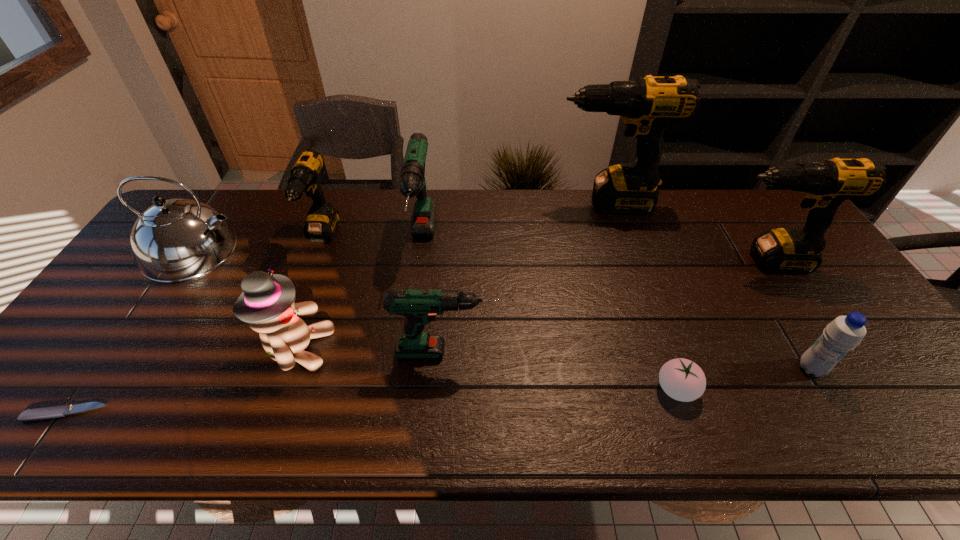
Identify the location of free spot located at the tip of the second biggest black drill. The width and height of the screenshot is (960, 540). (654, 261).

I want to click on vacant position located 0.250m on the handle side of the farther green drill, so click(406, 360).

At what (x,y) coordinates should I click in order to perform the action: click on free space located 0.120m from the spout of the kettle. Please return your answer as a coordinate pair (x, y). Image resolution: width=960 pixels, height=540 pixels. Looking at the image, I should click on (283, 251).

This screenshot has height=540, width=960. In order to click on vacant space located at the tip of the leftmost drill in this screenshot , I will do `click(284, 337)`.

The image size is (960, 540). What are the coordinates of `free space located on the front-facing side of the rag_doll` in the screenshot? It's located at (360, 349).

This screenshot has height=540, width=960. Identify the location of free region located on the handle side of the nearest drill. (587, 352).

Locate an element on the screen. This screenshot has height=540, width=960. vacant point located on the right of the water bottle is located at coordinates (872, 368).

Image resolution: width=960 pixels, height=540 pixels. I want to click on vacant space located 0.270m on the right of the tomato, so click(817, 389).

I want to click on vacant region located on the back of the steak knife, so click(87, 383).

Locate an element on the screen. This screenshot has height=540, width=960. kettle situated at the far edge is located at coordinates (175, 240).